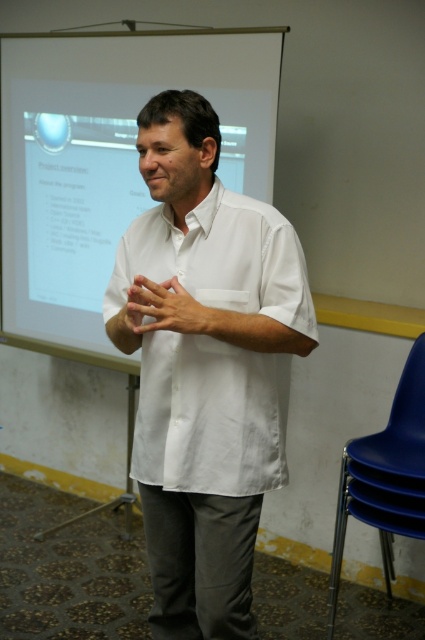
You are a student sitting in the front row of the classroom. You want to look at the slide on the white glossy projector screen at upper center while keeping your matte white hand at center visible to the teacher. Is it possible to do both at the same time?

The white glossy projector screen at upper center is located above the matte white hand at center, so yes, you can look at the slide on the white glossy projector screen at upper center while keeping your matte white hand at center visible to the teacher since they are positioned in different areas of the space.

You are a photographer positioned in front of the scene. You want to capture a closeup shot of the man without including the projection screen behind him. Given your current position, can you adjust your camera angle to focus solely on the white matte shirt at center while excluding the screen?

The white matte shirt at center is 1.62 meters from viewer. Since the shirt is relatively close, you can adjust your camera angle slightly downward or move closer to frame only the shirt and exclude the screen behind.

You are sitting in the blue plastic chair at lower right and want to reach out to touch the matte white hand at center. Can you physically reach it?

The blue plastic chair at lower right is further to the viewer than the matte white hand at center, so the distance between them makes it impossible to reach the matte white hand at center from the blue plastic chair at lower right.